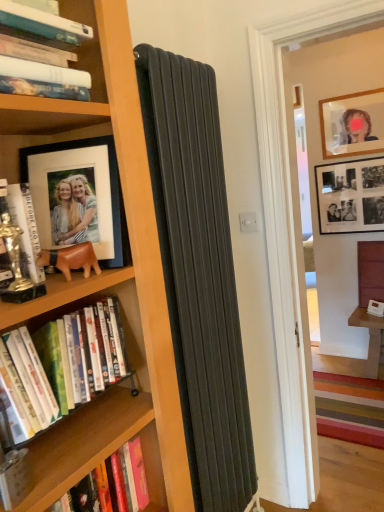
Where is `empty space that is ontop of black matte picture frame at left, which is the first picture frame in bottom-to-top order (from a real-world perspective)`? This screenshot has width=384, height=512. empty space that is ontop of black matte picture frame at left, which is the first picture frame in bottom-to-top order (from a real-world perspective) is located at coordinates (68, 121).